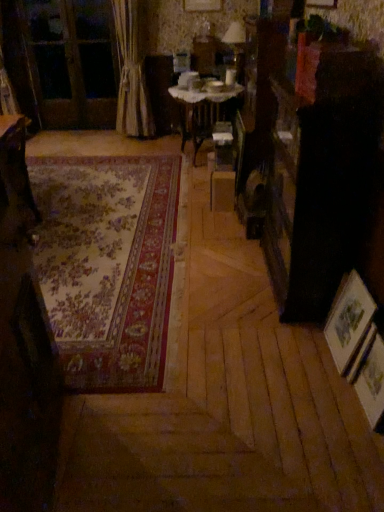
This screenshot has width=384, height=512. What do you see at coordinates (349, 321) in the screenshot?
I see `wooden picture frame at lower right, which is counted as the first picture frame, starting from the back` at bounding box center [349, 321].

This screenshot has height=512, width=384. What do you see at coordinates (131, 73) in the screenshot?
I see `beige fabric curtain at left` at bounding box center [131, 73].

The height and width of the screenshot is (512, 384). Describe the element at coordinates (72, 61) in the screenshot. I see `wooden screen door at upper left` at that location.

You are a GUI agent. You are given a task and a screenshot of the screen. Output one action in this format:
    pyautogui.click(x=<x>, y=<y>)
    Task: Click on the floral carpet at center
    The height and width of the screenshot is (512, 384).
    Given the screenshot: What is the action you would take?
    pyautogui.click(x=107, y=266)

Is wooden table at center, which is counted as the second table, starting from the front, positioned beyond the bounds of wooden picture frame at lower right, which is the first picture frame in front-to-back order?

Indeed, wooden table at center, which is counted as the second table, starting from the front, is completely outside wooden picture frame at lower right, which is the first picture frame in front-to-back order.

Considering the sizes of wooden table at center, which is the 1th table from top to bottom, and wooden picture frame at lower right, marked as the second picture frame in a back-to-front arrangement, in the image, is wooden table at center, which is the 1th table from top to bottom, taller or shorter than wooden picture frame at lower right, marked as the second picture frame in a back-to-front arrangement,?

Considering their sizes, wooden table at center, which is the 1th table from top to bottom, has more height than wooden picture frame at lower right, marked as the second picture frame in a back-to-front arrangement.

From a real-world perspective, which object rests below the other?

From a 3D spatial view, wooden picture frame at lower right, marked as the second picture frame in a back-to-front arrangement, is below.

Can you confirm if wooden table at center, acting as the first table starting from the right, is smaller than wooden picture frame at lower right, which is the first picture frame in front-to-back order?

Incorrect, wooden table at center, acting as the first table starting from the right, is not smaller in size than wooden picture frame at lower right, which is the first picture frame in front-to-back order.

In the scene shown: Can you confirm if wooden table at left, acting as the 1th table starting from the bottom, is thinner than wooden picture frame at lower right, which is the first picture frame in front-to-back order?

No.

From a real-world perspective, is wooden table at left, which ranks as the first table in front-to-back order, located beneath wooden picture frame at lower right, which is the first picture frame in front-to-back order?

No, from a real-world perspective, wooden table at left, which ranks as the first table in front-to-back order, is not beneath wooden picture frame at lower right, which is the first picture frame in front-to-back order.

Is wooden table at left, marked as the 2th table in a right-to-left arrangement, turned away from wooden picture frame at lower right, marked as the second picture frame in a back-to-front arrangement?

No, wooden table at left, marked as the 2th table in a right-to-left arrangement, is not facing the opposite direction of wooden picture frame at lower right, marked as the second picture frame in a back-to-front arrangement.

Considering the relative sizes of wooden table at left, the first table viewed from the left, and wooden picture frame at lower right, marked as the second picture frame in a back-to-front arrangement, in the image provided, is wooden table at left, the first table viewed from the left, smaller than wooden picture frame at lower right, marked as the second picture frame in a back-to-front arrangement,?

Actually, wooden table at left, the first table viewed from the left, might be larger than wooden picture frame at lower right, marked as the second picture frame in a back-to-front arrangement.

From the image's perspective, which object appears higher, floral carpet at center or wooden table at center, placed as the 2th table when sorted from left to right?

wooden table at center, placed as the 2th table when sorted from left to right, from the image's perspective.

Considering the sizes of objects floral carpet at center and wooden table at center, the 2th table from the bottom, in the image provided, who is thinner, floral carpet at center or wooden table at center, the 2th table from the bottom,?

Thinner between the two is wooden table at center, the 2th table from the bottom.

Which is nearer, (109, 288) or (226, 97)?

Point (109, 288)

Is matte glass table lamp at upper center positioned beyond the bounds of wooden picture frame at lower right, which is the first picture frame in front-to-back order?

matte glass table lamp at upper center is positioned outside wooden picture frame at lower right, which is the first picture frame in front-to-back order.

Considering the relative sizes of matte glass table lamp at upper center and wooden picture frame at lower right, marked as the second picture frame in a back-to-front arrangement, in the image provided, is matte glass table lamp at upper center shorter than wooden picture frame at lower right, marked as the second picture frame in a back-to-front arrangement,?

Incorrect, the height of matte glass table lamp at upper center does not fall short of that of wooden picture frame at lower right, marked as the second picture frame in a back-to-front arrangement.

Is matte glass table lamp at upper center in contact with wooden picture frame at lower right, marked as the second picture frame in a back-to-front arrangement?

matte glass table lamp at upper center and wooden picture frame at lower right, marked as the second picture frame in a back-to-front arrangement, are clearly separated.

From the image's perspective, is matte glass table lamp at upper center below wooden picture frame at lower right, marked as the second picture frame in a back-to-front arrangement?

Incorrect, from the image's perspective, matte glass table lamp at upper center is higher than wooden picture frame at lower right, marked as the second picture frame in a back-to-front arrangement.

Consider the image. How different are the orientations of beige fabric curtain at left and wooden picture frame at lower right, the 2th picture frame from the front, in degrees?

86.2 degrees.

Which is behind, beige fabric curtain at left or wooden picture frame at lower right, the 2th picture frame from the front?

beige fabric curtain at left is behind.

Between beige fabric curtain at left and wooden picture frame at lower right, which is counted as the first picture frame, starting from the back, which one has more height?

Standing taller between the two is beige fabric curtain at left.

Based on the photo, from the image's perspective, does beige fabric curtain at left appear lower than wooden picture frame at lower right, the 2th picture frame from the front?

No, from the image's perspective, beige fabric curtain at left is not below wooden picture frame at lower right, the 2th picture frame from the front.

Which is behind, point (347, 352) or point (241, 36)?

The point (241, 36) is farther.

Is wooden picture frame at lower right, which is counted as the first picture frame, starting from the back, aimed at matte glass table lamp at upper center?

No, wooden picture frame at lower right, which is counted as the first picture frame, starting from the back, is not turned towards matte glass table lamp at upper center.

Which is in front, point (380, 376) or point (239, 41)?

The point (380, 376) is more forward.

Find the location of a particular element. the 2nd picture frame to the right of the matte glass table lamp at upper center, starting your count from the anchor is located at coordinates (372, 383).

Is wooden picture frame at lower right, marked as the second picture frame in a back-to-front arrangement, facing towards matte glass table lamp at upper center?

No, wooden picture frame at lower right, marked as the second picture frame in a back-to-front arrangement, is not turned towards matte glass table lamp at upper center.

Can you confirm if wooden picture frame at lower right, which is the first picture frame in front-to-back order, is positioned to the left of matte glass table lamp at upper center?

No, wooden picture frame at lower right, which is the first picture frame in front-to-back order, is not to the left of matte glass table lamp at upper center.

Where is `the 2nd picture frame below when counting from the wooden table at center, which is counted as the second table, starting from the front (from the image's perspective)`? This screenshot has height=512, width=384. the 2nd picture frame below when counting from the wooden table at center, which is counted as the second table, starting from the front (from the image's perspective) is located at coordinates (372, 383).

The width and height of the screenshot is (384, 512). I want to click on the 2nd picture frame in front when counting from the wooden table at left, the second table in the top-to-bottom sequence, so click(x=372, y=383).

Estimate the real-world distances between objects in this image. Which object is closer to beige fabric curtain at left, wooden screen door at upper left or wooden table at center, which is the 1th table from top to bottom?

The object closer to beige fabric curtain at left is wooden screen door at upper left.

From the image, which object appears to be nearer to wooden screen door at upper left, matte glass table lamp at upper center or beige fabric curtain at left?

beige fabric curtain at left is closer to wooden screen door at upper left.

When comparing their distances from beige fabric curtain at left, does wooden picture frame at lower right, marked as the second picture frame in a back-to-front arrangement, or wooden table at left, the second table in the top-to-bottom sequence, seem further?

wooden picture frame at lower right, marked as the second picture frame in a back-to-front arrangement, lies further to beige fabric curtain at left than the other object.

When comparing their distances from beige fabric curtain at left, does matte glass table lamp at upper center or wooden picture frame at lower right, which is counted as the first picture frame, starting from the back, seem further?

Among the two, wooden picture frame at lower right, which is counted as the first picture frame, starting from the back, is located further to beige fabric curtain at left.

Looking at this image, when comparing their distances from wooden picture frame at lower right, the 2th picture frame from the front, does wooden screen door at upper left or matte glass table lamp at upper center seem closer?

matte glass table lamp at upper center is closer to wooden picture frame at lower right, the 2th picture frame from the front.

Consider the image. Estimate the real-world distances between objects in this image. Which object is closer to wooden table at left, which ranks as the first table in front-to-back order, beige fabric curtain at left or matte glass table lamp at upper center?

matte glass table lamp at upper center is closer to wooden table at left, which ranks as the first table in front-to-back order.

Based on their spatial positions, is beige fabric curtain at left or matte glass table lamp at upper center further from floral carpet at center?

matte glass table lamp at upper center is positioned further to the anchor floral carpet at center.

Estimate the real-world distances between objects in this image. Which object is further from matte glass table lamp at upper center, wooden table at left, the second table viewed from the back, or wooden screen door at upper left?

The object further to matte glass table lamp at upper center is wooden table at left, the second table viewed from the back.

This screenshot has height=512, width=384. I want to click on picture frame located between wooden picture frame at lower right, marked as the second picture frame in a back-to-front arrangement, and beige fabric curtain at left in the depth direction, so click(x=349, y=321).

This screenshot has height=512, width=384. I want to click on table between floral carpet at center and wooden table at center, which is the 1th table from top to bottom, along the z-axis, so click(x=15, y=183).

Locate an element on the screen. mat located between wooden picture frame at lower right, which is counted as the first picture frame, starting from the back, and matte glass table lamp at upper center in the depth direction is located at coordinates (107, 266).

I want to click on curtain between wooden picture frame at lower right, the 2th picture frame from the front, and matte glass table lamp at upper center in the front-back direction, so click(131, 73).